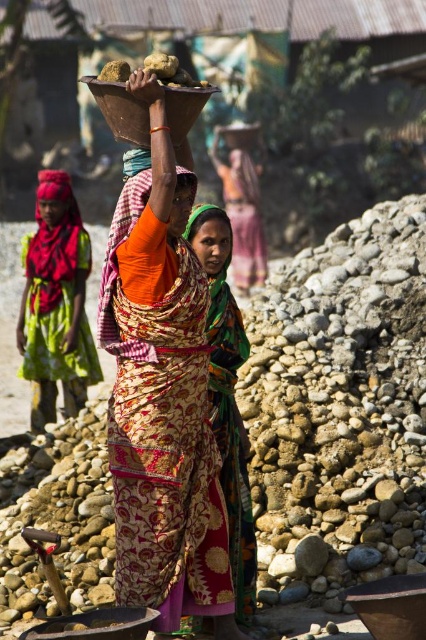
You are a fashion designer observing the rural scene. You notice the printed fabric sari at center and the multicolored fabric headscarf at center. Which fabric item has a greater width?

The printed fabric sari at center has a greater width than the multicolored fabric headscarf at center according to the description.

Based on the scene described, which object is positioned lower in the image, the printed fabric sari at center or the pink fabric headscarf at upper left?

The printed fabric sari at center is located below the pink fabric headscarf at upper left, so it is positioned lower in the image.

You are standing at the origin point in the image. Which direction should you move to reach the printed fabric sari at center?

The printed fabric sari at center is located at point 0.631 on the x axis and 0.380 on the y axis. Since you are at the origin, you should move right along the x axis and slightly up along the y axis to reach it.